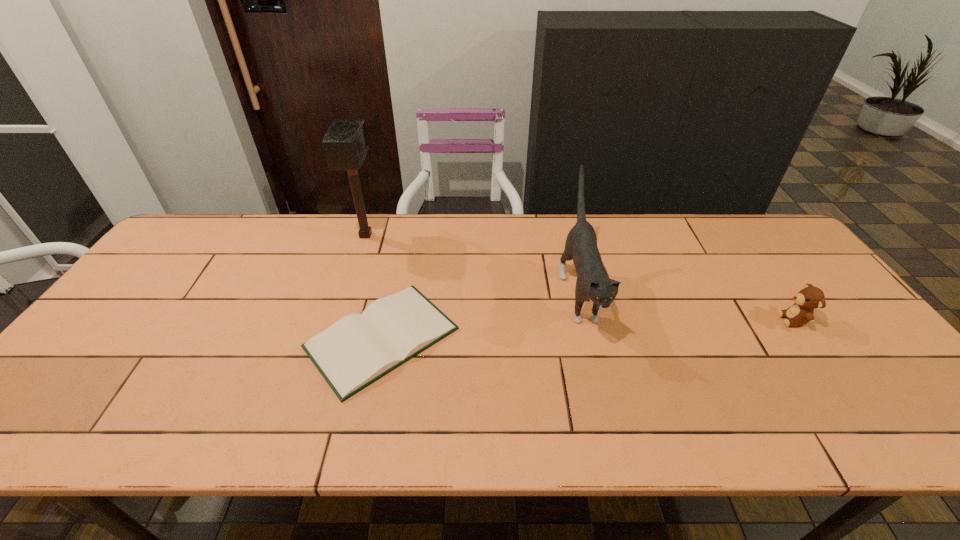
This screenshot has width=960, height=540. I want to click on blank region between the rightmost object and the cat, so click(x=686, y=306).

Locate an element on the screen. Image resolution: width=960 pixels, height=540 pixels. free spot between the hardback book and the third tallest object is located at coordinates (588, 329).

Image resolution: width=960 pixels, height=540 pixels. I want to click on vacant region between the shortest object and the mallet, so click(x=373, y=287).

The height and width of the screenshot is (540, 960). Identify the location of free space between the hardback book and the cat. (481, 315).

The height and width of the screenshot is (540, 960). I want to click on free space that is in between the hardback book and the rightmost object, so click(588, 329).

The height and width of the screenshot is (540, 960). I want to click on vacant area that lies between the cat and the mallet, so click(x=472, y=264).

Find the location of a particular element. free space between the second object from right to left and the mallet is located at coordinates (472, 264).

Locate an element on the screen. This screenshot has height=540, width=960. free point between the second tallest object and the rightmost object is located at coordinates (686, 306).

Point out which object is positioned as the third nearest to the second object from right to left. Please provide its 2D coordinates. Your answer should be formatted as a tuple, i.e. [(x, y)], where the tuple contains the x and y coordinates of a point satisfying the conditions above.

[(345, 143)]

Select which object appears as the closest to the third tallest object. Please provide its 2D coordinates. Your answer should be formatted as a tuple, i.e. [(x, y)], where the tuple contains the x and y coordinates of a point satisfying the conditions above.

[(593, 284)]